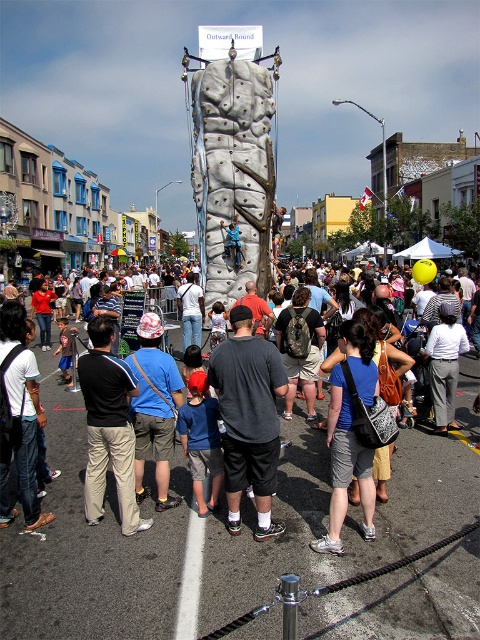
Which of these two, matte gray climbing wall at center or dark gray fabric shorts at center, stands taller?

With more height is dark gray fabric shorts at center.

Between matte gray climbing wall at center and dark gray fabric shorts at center, which one is positioned lower?

dark gray fabric shorts at center is lower down.

Who is more forward, (429, 528) or (257, 346)?

Point (429, 528) is in front.

Image resolution: width=480 pixels, height=640 pixels. Identify the location of matte gray climbing wall at center. (225, 518).

Is white textured climbing wall at center to the right of denim shorts at center from the viewer's perspective?

In fact, white textured climbing wall at center is to the left of denim shorts at center.

Is white textured climbing wall at center to the left of denim shorts at center from the viewer's perspective?

Indeed, white textured climbing wall at center is positioned on the left side of denim shorts at center.

This screenshot has height=640, width=480. I want to click on white textured climbing wall at center, so tap(232, 170).

The width and height of the screenshot is (480, 640). I want to click on white textured climbing wall at center, so click(232, 170).

Between point (82, 465) and point (348, 460), which one is positioned in front?

Point (348, 460)

Can you confirm if matte gray climbing wall at center is positioned to the left of denim shorts at center?

Indeed, matte gray climbing wall at center is positioned on the left side of denim shorts at center.

Does point (56, 481) come behind point (347, 333)?

Yes, it is behind point (347, 333).

The width and height of the screenshot is (480, 640). In order to click on matte gray climbing wall at center in this screenshot , I will do `click(225, 518)`.